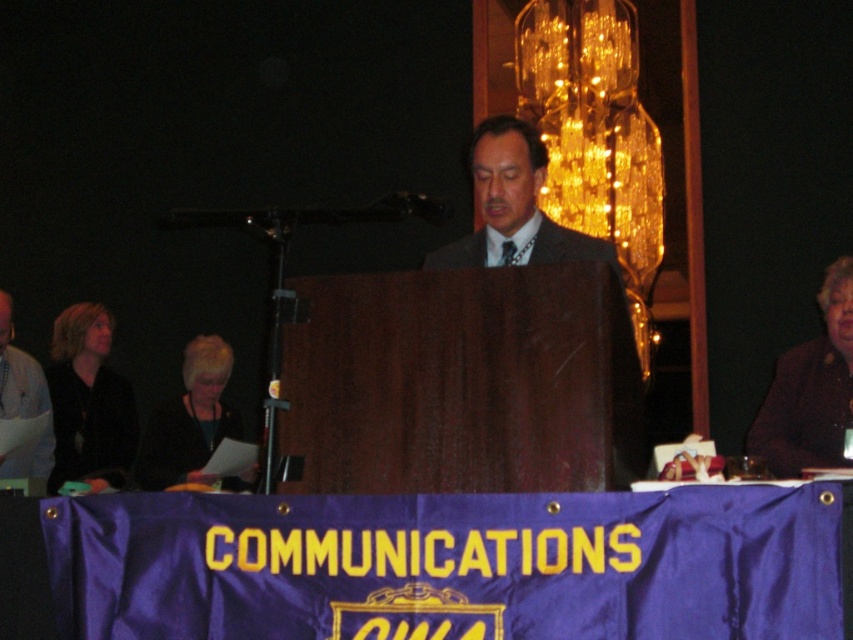
Between point (206, 400) and point (32, 529), which one is positioned in front?

Point (32, 529) is more forward.

Is point (181, 378) positioned before point (20, 544)?

No.

Between point (201, 416) and point (9, 618), which one is positioned behind?

The point (201, 416) is more distant.

You are a GUI agent. You are given a task and a screenshot of the screen. Output one action in this format:
    pyautogui.click(x=<x>, y=<y>)
    Task: Click on the dark brown hair at lower left
    This screenshot has width=853, height=640.
    Given the screenshot: What is the action you would take?
    pyautogui.click(x=192, y=422)

Can you confirm if dark brown hair at left is positioned to the right of dark brown hair at lower left?

In fact, dark brown hair at left is to the left of dark brown hair at lower left.

I want to click on dark brown hair at left, so click(x=90, y=403).

Identify the location of dark brown hair at left. (90, 403).

Can you confirm if dark brown hair at left is positioned to the left of matte black jacket at lower left?

Indeed, dark brown hair at left is positioned on the left side of matte black jacket at lower left.

Which is in front, point (97, 324) or point (12, 348)?

Point (12, 348)

Where is `dark brown hair at left`? The width and height of the screenshot is (853, 640). dark brown hair at left is located at coordinates (90, 403).